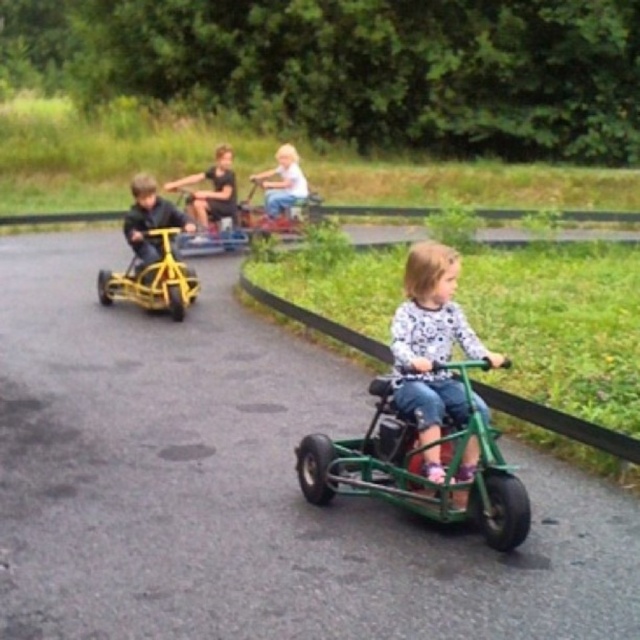
You are a photographer standing at the starting line of the go kart track. You want to take a photo of the two points mentioned. Which point is closer to you, point (312, 493) or point (234, 192)?

Point (234, 192) is closer to you because it is behind point (312, 493).